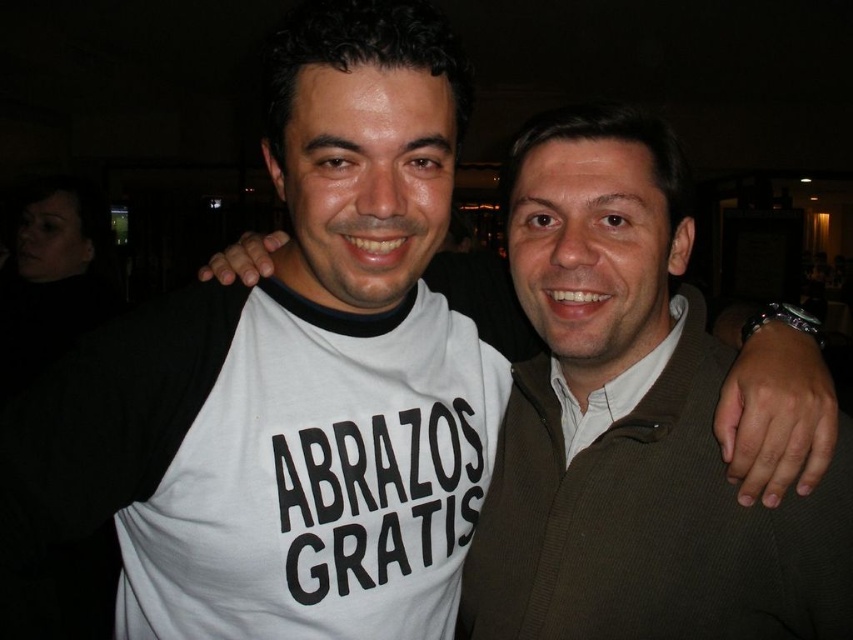
Question: Which of the following is the closest to the observer?

Choices:
 (A) white cotton shirt at center
 (B) matte brown shirt at center

Answer: (A)

Question: Does white cotton shirt at center have a smaller size compared to matte brown shirt at center?

Choices:
 (A) yes
 (B) no

Answer: (B)

Question: Does white cotton shirt at center appear under matte brown shirt at center?

Choices:
 (A) yes
 (B) no

Answer: (A)

Question: Is white cotton shirt at center below matte brown shirt at center?

Choices:
 (A) no
 (B) yes

Answer: (B)

Question: Which object is closer to the camera taking this photo?

Choices:
 (A) white cotton shirt at center
 (B) matte brown shirt at center

Answer: (A)

Question: Which point is farther from the camera taking this photo?

Choices:
 (A) (608, 476)
 (B) (595, 433)

Answer: (B)